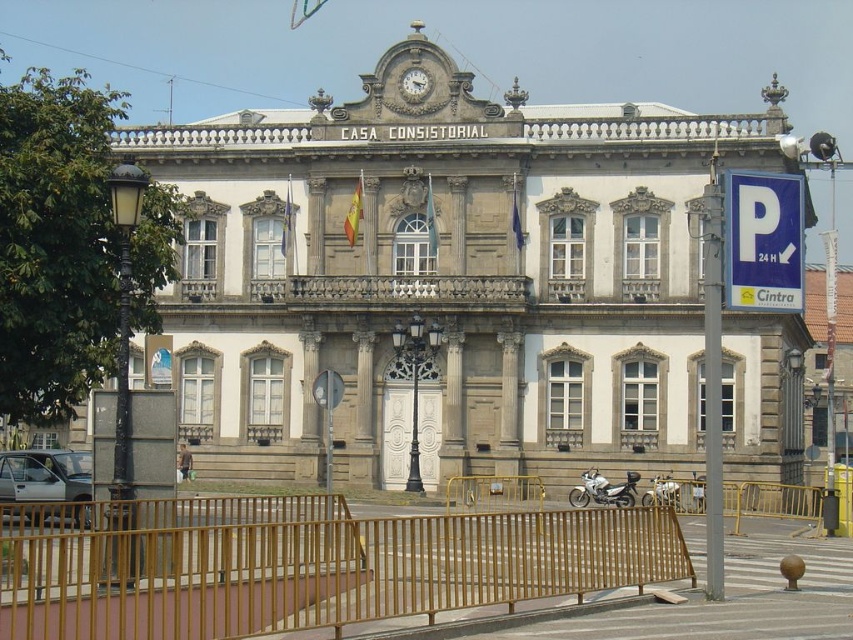
You are a tour guide explaining the CASA CONSISTORIAL building to visitors. You mention the stone building at center and the gold textured clock at upper center. Which one is taller?

The stone building at center is taller than the gold textured clock at upper center.

You are a pedestrian standing on the sidewalk in front of CASA CONSISTORIAL. You see two motorcycles, a white metallic motorcycle at center and a silver metallic motorcycle at center. Which one is positioned to the left?

The white metallic motorcycle at center is positioned to the left of the silver metallic motorcycle at center.

You are a delivery person needing to park your vehicle near the CASA CONSISTORIAL building. You see the stone building at center and the blue plastic parking sign at upper right. Which object is wider, and would that affect where you park?

The stone building at center is wider than the blue plastic parking sign at upper right. Since the building is wider, you should consider parking in an area that allows enough space around the building, ensuring you don comply with any parking restrictions indicated by the sign.